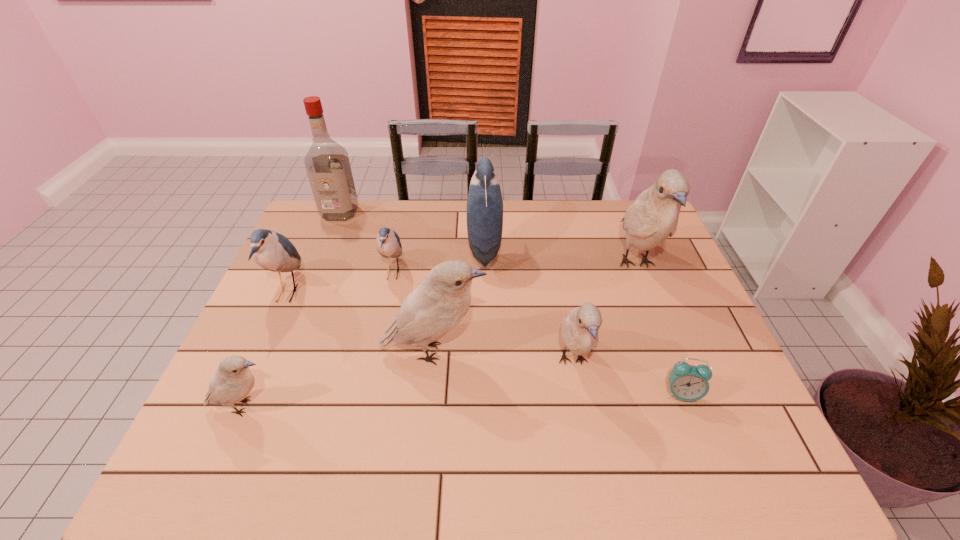
In the image, there is a desktop. In order to click on vacant region at the right edge in this screenshot , I will do `click(691, 422)`.

The image size is (960, 540). Identify the location of vacant space at the far left corner of the desktop. (333, 241).

In the image, there is a desktop. Identify the location of free region at the near left corner. (234, 446).

Where is `free location at the near right corner of the desktop`? This screenshot has width=960, height=540. free location at the near right corner of the desktop is located at coordinates pos(727,450).

The image size is (960, 540). Identify the location of vacant space in between the leftmost white bird and the second white bird from left to right. (339, 379).

Image resolution: width=960 pixels, height=540 pixels. In order to click on free space between the rightmost blue bird and the biggest white bird in this screenshot , I will do `click(560, 256)`.

Where is `vacant space that is in between the smallest white bird and the second white bird from left to right`? The height and width of the screenshot is (540, 960). vacant space that is in between the smallest white bird and the second white bird from left to right is located at coordinates (339, 379).

At what (x,y) coordinates should I click in order to perform the action: click on vacant point located between the farthest object and the rightmost blue bird. Please return your answer as a coordinate pair (x, y). Looking at the image, I should click on (412, 231).

Where is `unoccupied position between the third smallest white bird and the second smallest white bird`? unoccupied position between the third smallest white bird and the second smallest white bird is located at coordinates (503, 356).

Where is `free area in between the second white bird from left to right and the second white bird from right to left`? free area in between the second white bird from left to right and the second white bird from right to left is located at coordinates (503, 356).